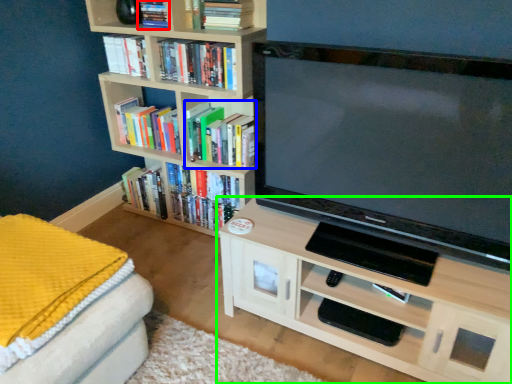
Question: Which object is the farthest from book (highlighted by a red box)? Choose among these: book (highlighted by a blue box) or shelf (highlighted by a green box).

Choices:
 (A) book
 (B) shelf

Answer: (B)